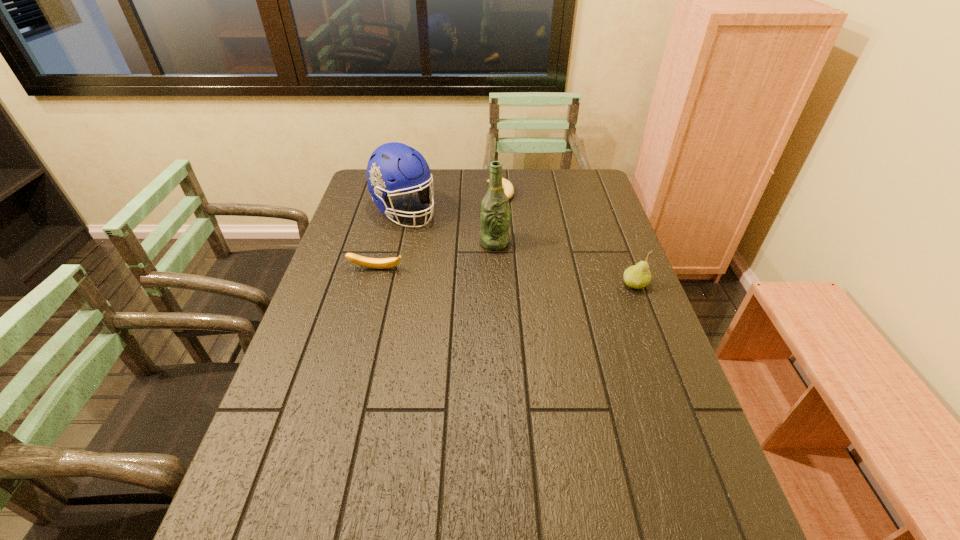
The height and width of the screenshot is (540, 960). What are the coordinates of `the taller banana` in the screenshot? It's located at (378, 263).

Identify the location of the left banana. (378, 263).

Identify the location of pear. (638, 276).

I want to click on the rightmost object, so click(x=638, y=276).

The height and width of the screenshot is (540, 960). What are the coordinates of `the fourth shortest object` in the screenshot? It's located at (393, 167).

The height and width of the screenshot is (540, 960). In order to click on beer bottle in this screenshot , I will do `click(494, 234)`.

Locate an element on the screen. This screenshot has width=960, height=540. the farther banana is located at coordinates [x=508, y=188].

The height and width of the screenshot is (540, 960). In order to click on the right banana in this screenshot , I will do `click(508, 188)`.

At what (x,y) coordinates should I click in order to perform the action: click on free region located 0.340m at the stem of the second nearest object. Please return your answer as a coordinate pair (x, y). Looking at the image, I should click on (350, 366).

Where is `vacant space located on the left of the rightmost object`? vacant space located on the left of the rightmost object is located at coordinates (529, 285).